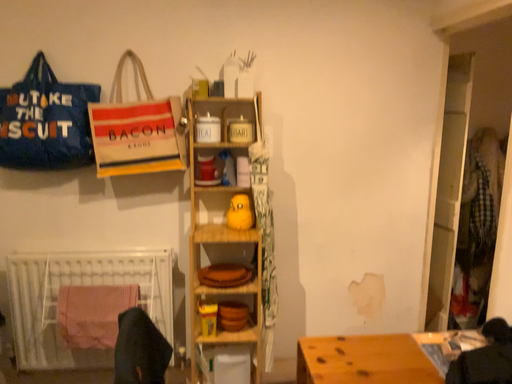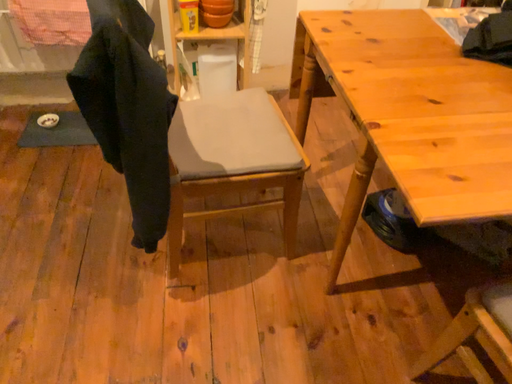
Question: Which way did the camera rotate in the video?

Choices:
 (A) rotated downward
 (B) rotated upward

Answer: (A)